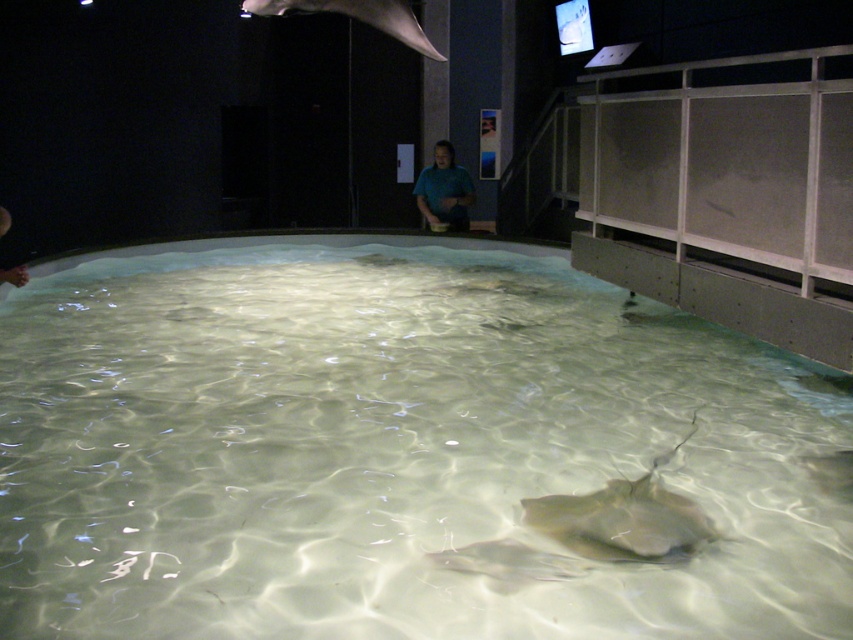
Question: Can you confirm if smooth gray stingray at upper center is wider than smooth skin human at lower left?

Choices:
 (A) yes
 (B) no

Answer: (A)

Question: Which of the following is the farthest from the observer?

Choices:
 (A) clear glass swimming pool at center
 (B) smooth gray stingray at upper center

Answer: (B)

Question: Which point is farther to the camera?

Choices:
 (A) (602, 536)
 (B) (19, 269)
 (C) (606, 618)
 (D) (433, 182)

Answer: (D)

Question: Which object is closer to the camera taking this photo?

Choices:
 (A) blue matte shirt at center
 (B) smooth skin human at lower left
 (C) smooth gray stingray at upper center

Answer: (B)

Question: Considering the relative positions of smooth gray stingray at upper center and smooth skin human at lower left in the image provided, where is smooth gray stingray at upper center located with respect to smooth skin human at lower left?

Choices:
 (A) left
 (B) right

Answer: (B)

Question: Is smooth gray stingray at upper center positioned behind smooth skin human at lower left?

Choices:
 (A) no
 (B) yes

Answer: (B)